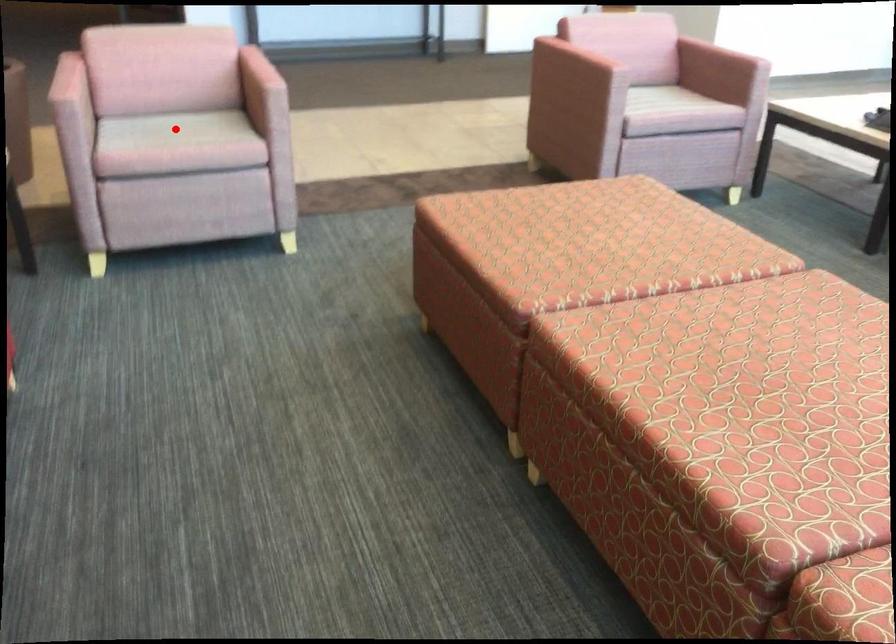
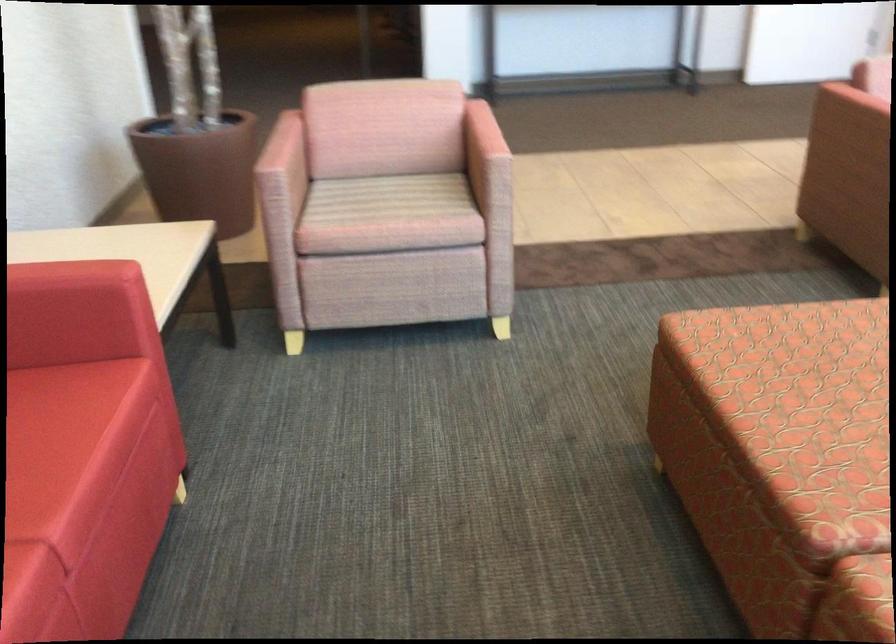
Find the pixel in the second image that matches the highlighted location in the first image.

(389, 198)